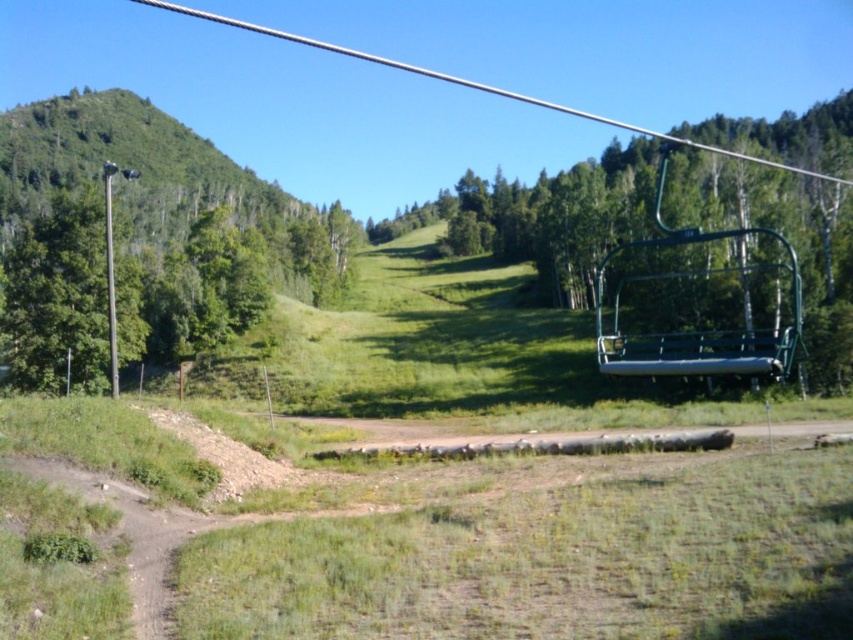
You are standing at the center of the grassy field in the image. Which direction should you walk to reach the green metal chair at upper right?

You should walk northeast to reach the green metal chair at upper right because it is located at point (677,253), which is northeast of the center point.

Based on the photo, you are standing at the center of the grassy field and want to walk to the green metal chair at upper right. Which direction should you head towards relative to the green leafy tree at left?

You should head towards the right side of the green leafy tree at left to reach the green metal chair at upper right since the green metal chair at upper right is located to the right of the green leafy tree at left.

You are planning to set up a tent in the grassy field. You need to choose a spot that is not under the shade of the green leafy tree at left but still close to the metallic pole at left. Can you find such a spot?

Yes, since the green leafy tree at left is not as tall as the metallic pole at left, the pole is taller and its shade might extend further. However, the question specifies avoiding the tree shade, so positioning near the pole but outside the tree shade is possible.